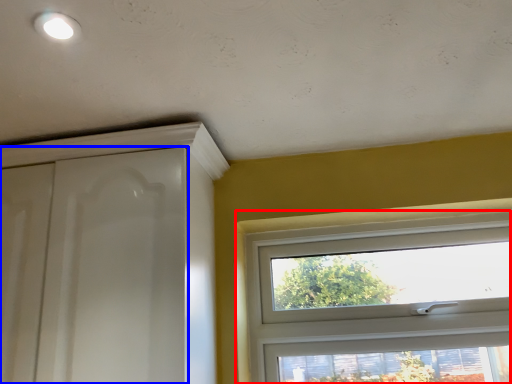
Question: Which of the following is the closest to the observer, window (highlighted by a red box) or screen door (highlighted by a blue box)?

Choices:
 (A) window
 (B) screen door

Answer: (B)